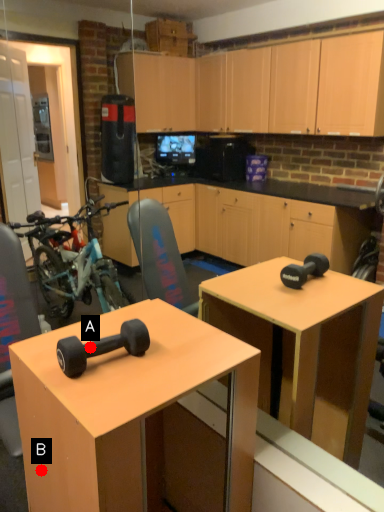
Question: Two points are circled on the image, labeled by A and B beside each circle. Which of the following is the closest to the observer?

Choices:
 (A) A is closer
 (B) B is closer

Answer: (A)